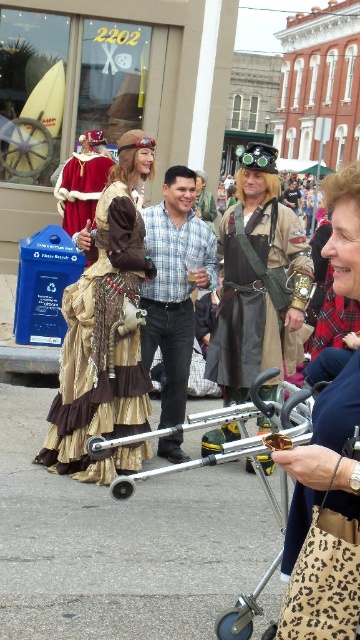
You are a photographer at the festival and want to capture both the gold fabric dress at center and the plaid shirt at center in a single shot. Which one should you focus on first to ensure they are both in frame?

The gold fabric dress at center is positioned on the left side of plaid shirt at center, so focusing on the plaid shirt at center first would help ensure both are within the frame as the dress is to the left of it.

You are a street performer who needs to place a small prop on top of either the leopard print purse at center or the metallic silver baby carriage at center. Which object should you choose to ensure the prop stays stable?

The leopard print purse at center has a greater height compared to metallic silver baby carriage at center, so placing the prop on the leopard print purse at center would provide a more stable base since it is taller and less likely to tip over.

You are standing at the center of the street where the steampunk costume person is. You want to reach the point at coordinate (345, 262) as quickly as possible. Is the point closer to you or further away than 100 feet?

The point at coordinate (345, 262) is 70.76 feet from the viewer, so it is closer than 100 feet.